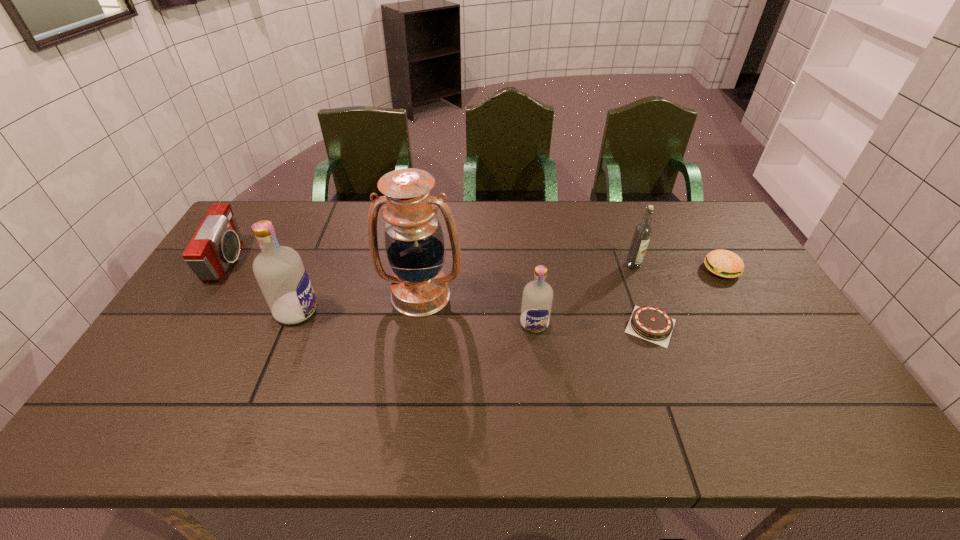
Identify the location of the second object from left to right. This screenshot has width=960, height=540. (281, 275).

In order to click on the leftmost vodka in this screenshot , I will do `click(281, 275)`.

At what (x,y) coordinates should I click in order to perform the action: click on the second vodka from left to right. Please return your answer as a coordinate pair (x, y). This screenshot has height=540, width=960. Looking at the image, I should click on (537, 297).

Find the location of a particular element. The width and height of the screenshot is (960, 540). the farthest vodka is located at coordinates (643, 231).

In order to click on the fifth tallest object in this screenshot , I will do `click(216, 244)`.

You are a GUI agent. You are given a task and a screenshot of the screen. Output one action in this format:
    pyautogui.click(x=<x>, y=<y>)
    Task: Click on the camera
    The height and width of the screenshot is (540, 960).
    Given the screenshot: What is the action you would take?
    pyautogui.click(x=216, y=244)

Where is `the tallest object`? This screenshot has width=960, height=540. the tallest object is located at coordinates (414, 242).

I want to click on the fifth object from right to left, so click(414, 242).

The height and width of the screenshot is (540, 960). I want to click on the shortest object, so [650, 323].

This screenshot has width=960, height=540. In order to click on the second shortest object in this screenshot , I will do `click(723, 263)`.